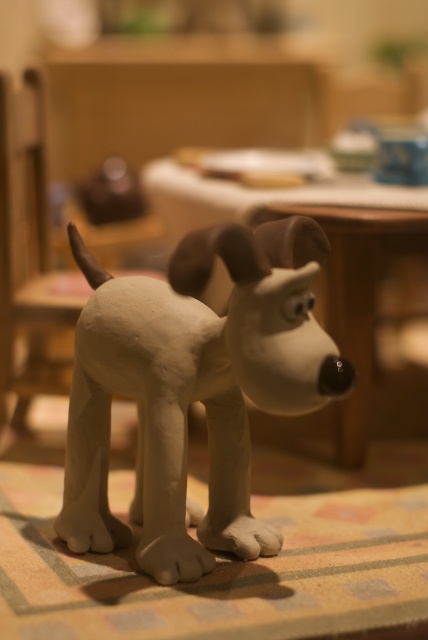
Question: Which point appears closest to the camera in this image?

Choices:
 (A) (350, 378)
 (B) (272, 385)

Answer: (B)

Question: Which point is farther from the camera taking this photo?

Choices:
 (A) (350, 384)
 (B) (341, 317)

Answer: (B)

Question: Is white matte dog at center further to camera compared to black matte nose at center?

Choices:
 (A) yes
 (B) no

Answer: (B)

Question: Among these points, which one is farthest from the camera?

Choices:
 (A) (287, 426)
 (B) (287, 365)
 (C) (339, 356)

Answer: (A)

Question: Does wooden table at center appear under black matte nose at center?

Choices:
 (A) no
 (B) yes

Answer: (A)

Question: Does white matte dog at center have a greater width compared to black matte nose at center?

Choices:
 (A) no
 (B) yes

Answer: (B)